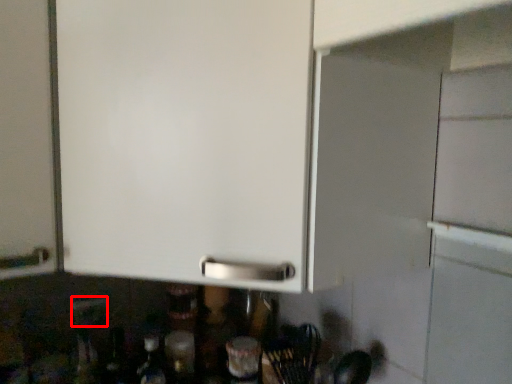
Question: Observing the image, what is the correct spatial positioning of electric outlet (annotated by the red box) in reference to bottle?

Choices:
 (A) right
 (B) left

Answer: (B)